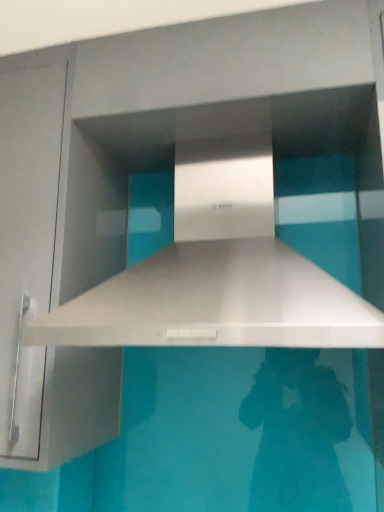
The image size is (384, 512). In order to click on white glossy vent at center in this screenshot , I will do `click(218, 273)`.

In order to face white glossy vent at center, should I rotate leftwards or rightwards?

A 4.230 degree turn to the right will do.

What do you see at coordinates (218, 273) in the screenshot? I see `white glossy vent at center` at bounding box center [218, 273].

Where is `white glossy vent at center`? Image resolution: width=384 pixels, height=512 pixels. white glossy vent at center is located at coordinates (218, 273).